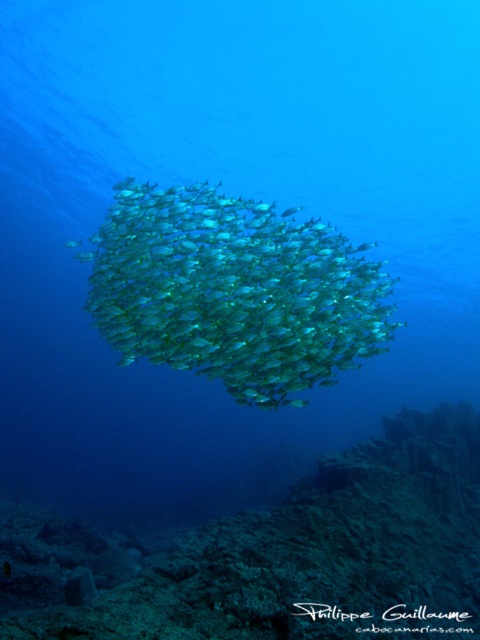
You are a marine biologist studying underwater formations. You observe a point marked at coordinates (317, 554) in the image. Based on the scene description, what does this point likely represent?

The point at coordinates (317, 554) corresponds to the rugged stone coral reef at center, as stated in the Objects Description.

You are a scuba diver with a 30 feet air supply safety limit. You are currently observing the rugged stone coral reef at center. Can you safely approach it without exceeding your air supply limit?

The rugged stone coral reef at center is 34.01 feet away from the viewer. Since your safety limit is 30 feet, you should not proceed further to avoid exceeding your air supply limit.